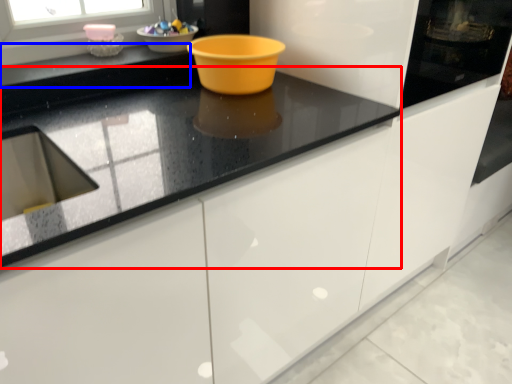
Question: Which object is further to the camera taking this photo, countertop (highlighted by a red box) or counter top (highlighted by a blue box)?

Choices:
 (A) countertop
 (B) counter top

Answer: (B)